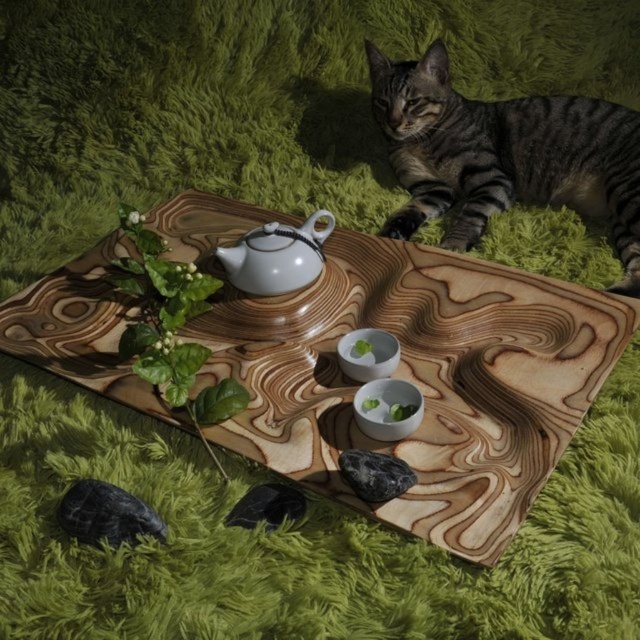
Question: Which of the following is the farthest from the observer?

Choices:
 (A) white glossy teapot at center
 (B) tabby fur cat at upper right
 (C) white glossy bowls at center
 (D) wooden tray at center

Answer: (B)

Question: Considering the relative positions of tabby fur cat at upper right and white glossy teapot at center in the image provided, where is tabby fur cat at upper right located with respect to white glossy teapot at center?

Choices:
 (A) above
 (B) below

Answer: (A)

Question: Is wooden tray at center positioned in front of tabby fur cat at upper right?

Choices:
 (A) yes
 (B) no

Answer: (A)

Question: Which is nearer to the white glossy bowls at center?

Choices:
 (A) tabby fur cat at upper right
 (B) wooden tray at center

Answer: (B)

Question: Which object appears closest to the camera in this image?

Choices:
 (A) wooden tray at center
 (B) white glossy bowls at center
 (C) tabby fur cat at upper right
 (D) white glossy teapot at center

Answer: (A)

Question: Can you confirm if wooden tray at center is thinner than white glossy teapot at center?

Choices:
 (A) yes
 (B) no

Answer: (B)